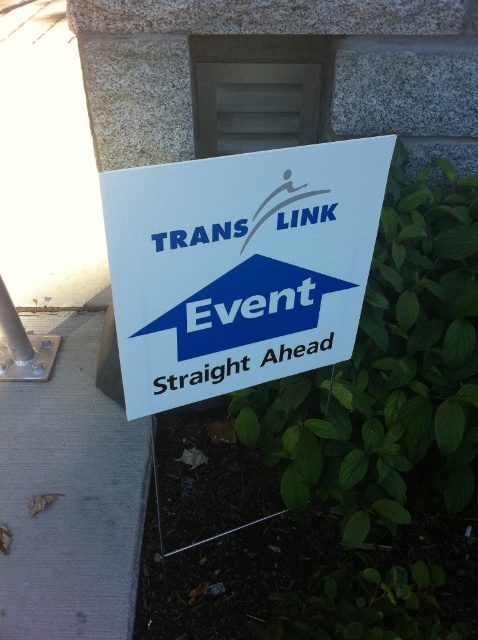
Question: Is white paper sign at center closer to camera compared to gray concrete pavement at lower left?

Choices:
 (A) no
 (B) yes

Answer: (B)

Question: Considering the real-world distances, which object is farthest from the white paper sign at center?

Choices:
 (A) gray concrete pavement at lower left
 (B) blue paper sign at center

Answer: (A)

Question: Is white paper sign at center to the left of gray concrete pavement at lower left from the viewer's perspective?

Choices:
 (A) yes
 (B) no

Answer: (B)

Question: Which point is closer to the camera?

Choices:
 (A) blue paper sign at center
 (B) white paper sign at center
 (C) gray concrete pavement at lower left

Answer: (B)

Question: Considering the relative positions of gray concrete pavement at lower left and blue paper sign at center in the image provided, where is gray concrete pavement at lower left located with respect to blue paper sign at center?

Choices:
 (A) right
 (B) left

Answer: (B)

Question: Among these objects, which one is nearest to the camera?

Choices:
 (A) white paper sign at center
 (B) blue paper sign at center

Answer: (A)